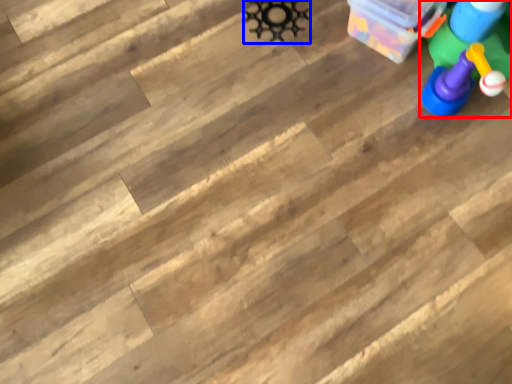
Question: Which object is closer to the camera taking this photo, toy (highlighted by a red box) or toy (highlighted by a blue box)?

Choices:
 (A) toy
 (B) toy

Answer: (A)